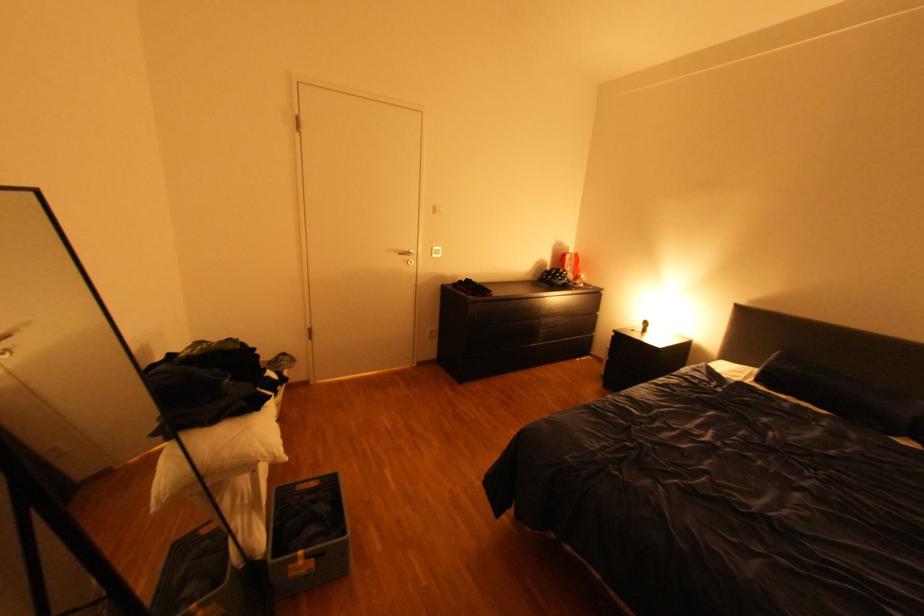
The width and height of the screenshot is (924, 616). I want to click on dark blue pillow, so click(844, 395).